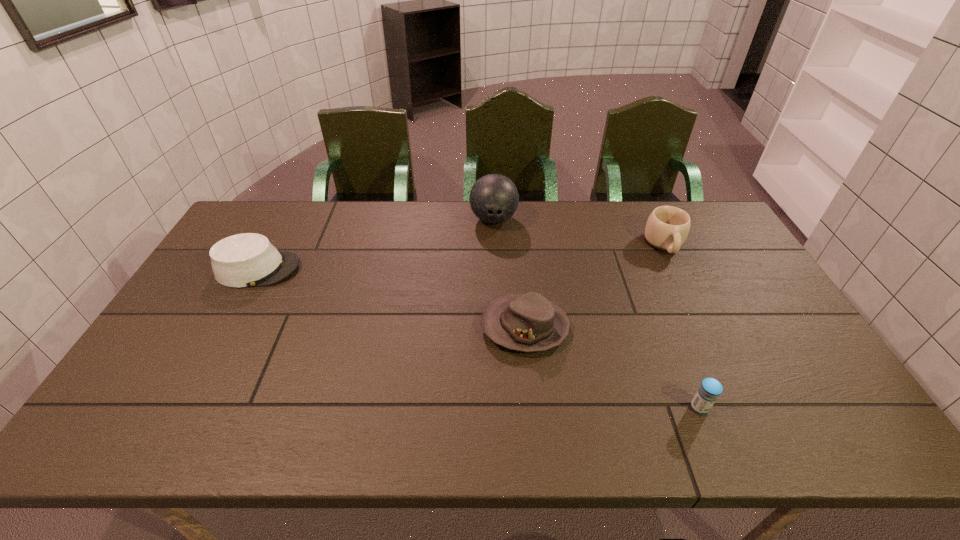
At what (x,y) coordinates should I click in order to perform the action: click on vacant space that's between the medicine and the mug. Please return your answer as a coordinate pair (x, y). Looking at the image, I should click on (682, 326).

You are a GUI agent. You are given a task and a screenshot of the screen. Output one action in this format:
    pyautogui.click(x=<x>, y=<y>)
    Task: Click on the free point between the nearer hat and the medicine
    This screenshot has height=540, width=960.
    Given the screenshot: What is the action you would take?
    pyautogui.click(x=612, y=367)

The width and height of the screenshot is (960, 540). I want to click on vacant space in between the medicine and the nearer hat, so click(x=612, y=367).

Where is `free space between the leftmost object and the rightmost object`? Image resolution: width=960 pixels, height=540 pixels. free space between the leftmost object and the rightmost object is located at coordinates (461, 256).

Where is `free space between the mug and the nearer hat`? free space between the mug and the nearer hat is located at coordinates (594, 286).

The height and width of the screenshot is (540, 960). What are the coordinates of `empty space between the nearer hat and the medicine` in the screenshot? It's located at (612, 367).

Identify which object is the third closest to the tallest object. Please provide its 2D coordinates. Your answer should be formatted as a tuple, i.e. [(x, y)], where the tuple contains the x and y coordinates of a point satisfying the conditions above.

[(244, 260)]

Identify which object is the closest to the second nearest object. Please provide its 2D coordinates. Your answer should be formatted as a tuple, i.e. [(x, y)], where the tuple contains the x and y coordinates of a point satisfying the conditions above.

[(707, 394)]

Locate an element on the screen. This screenshot has height=540, width=960. vacant space that satisfies the following two spatial constraints: 1. on the side of the rightmost object with the handle; 2. on the decorative side of the fourth farthest object is located at coordinates (705, 327).

Find the location of a particular element. This screenshot has width=960, height=540. blank space that satisfies the following two spatial constraints: 1. on the decorative side of the medicine; 2. on the right side of the nearer hat is located at coordinates (533, 408).